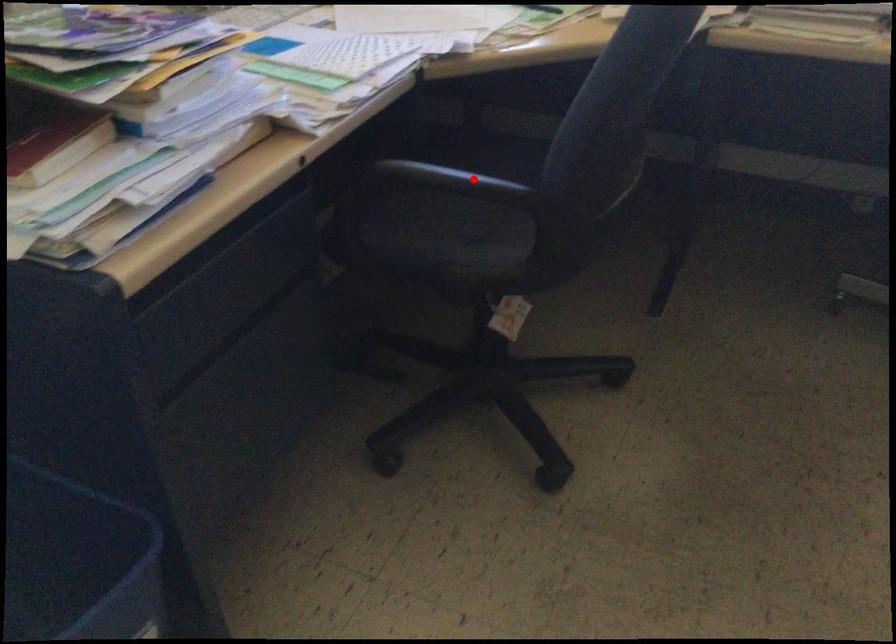
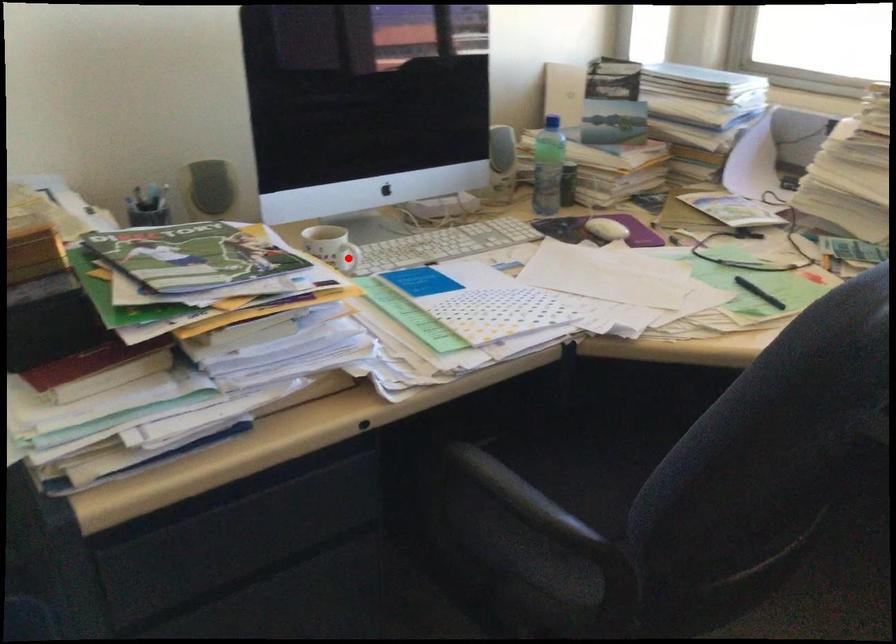
I am providing you with two images of the same scene from different viewpoints. A red point is marked on the first image and another point is marked on the second image. Does the point marked in image1 correspond to the same location as the one in image2?

No